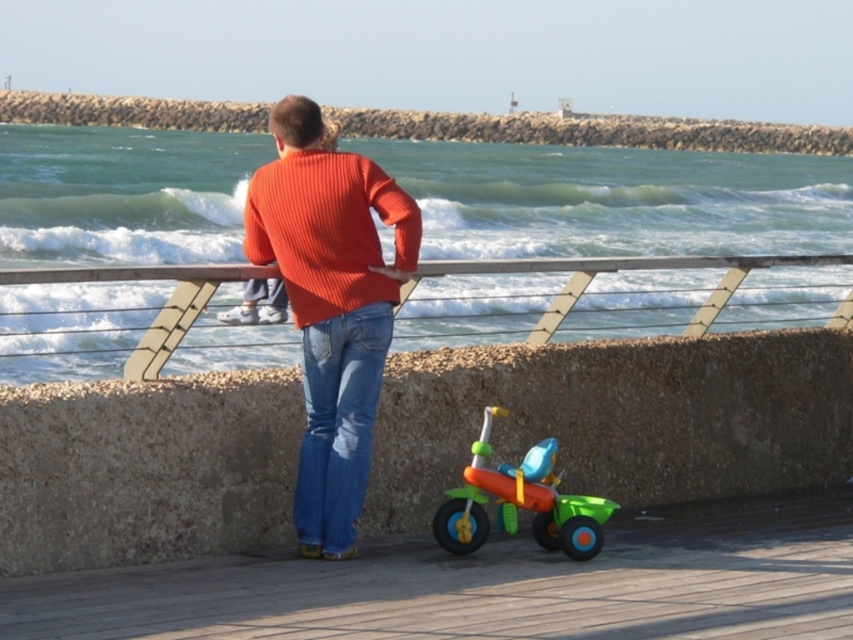
You are standing at the seaside promenade and want to know how far the brushed concrete wall at upper center is from your current position. Can you determine the distance?

The brushed concrete wall at upper center is 84.98 meters away from the viewer.

You are standing on the seaside promenade and want to take a photo of the brushed concrete wall at upper center without the green plastic tricycle at lower center blocking the view. Is the tricycle in front of or behind the wall?

The green plastic tricycle at lower center is in front of the brushed concrete wall at upper center because the wall is further away from the viewer than the tricycle.

You are a parent at the seaside promenade looking for your child. You see the wooden dock at lower center and the green plastic tricycle at lower center. Which object is closer to the ground?

The wooden dock at lower center is below the green plastic tricycle at lower center, so the wooden dock is closer to the ground.